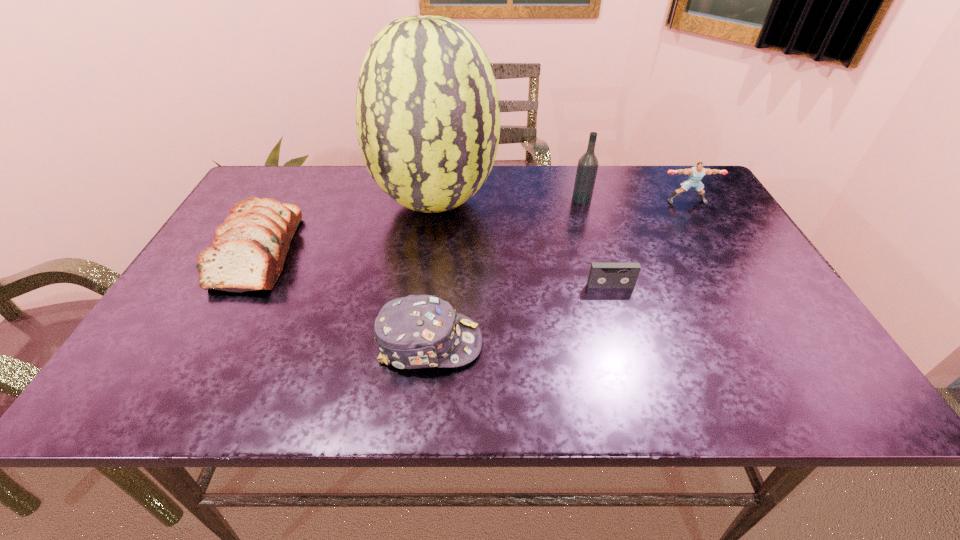
Locate an element on the screen. Image resolution: width=960 pixels, height=540 pixels. the tallest object is located at coordinates (427, 107).

Locate an element on the screen. the fifth shortest object is located at coordinates click(587, 167).

Find the location of `the rightmost object`. the rightmost object is located at coordinates (696, 173).

I want to click on bread, so click(x=249, y=249).

Image resolution: width=960 pixels, height=540 pixels. What are the coordinates of `headwear` in the screenshot? It's located at (417, 331).

This screenshot has width=960, height=540. What are the coordinates of `the shortest object` in the screenshot? It's located at (602, 275).

Find the location of a particular element. free location located on the right of the tallest object is located at coordinates (604, 203).

Where is `vacant point located 0.380m on the left of the vodka`? The width and height of the screenshot is (960, 540). vacant point located 0.380m on the left of the vodka is located at coordinates (439, 199).

Where is `vacant space located 0.150m on the front-facing side of the puncher`? vacant space located 0.150m on the front-facing side of the puncher is located at coordinates tap(708, 239).

Locate an element on the screen. free region located on the front of the bread is located at coordinates (184, 388).